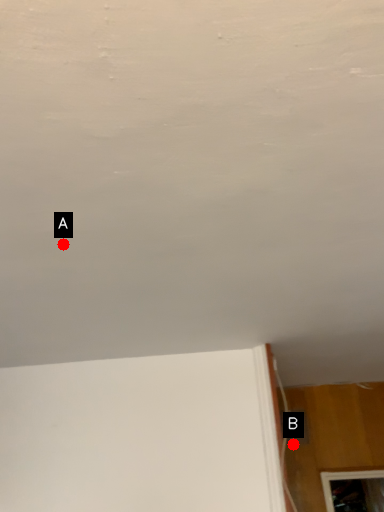
Question: Two points are circled on the image, labeled by A and B beside each circle. Which point appears closest to the camera in this image?

Choices:
 (A) A is closer
 (B) B is closer

Answer: (A)